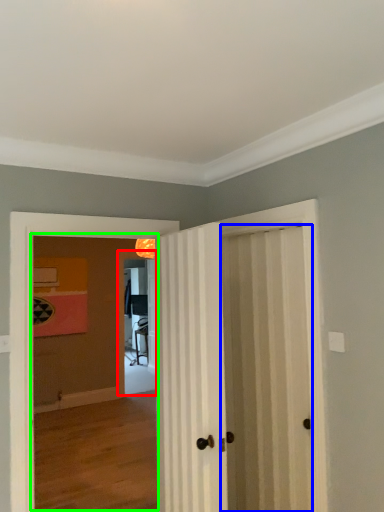
Question: Which is farther away from screen door (highlighted by a red box)? door (highlighted by a blue box) or corridor (highlighted by a green box)?

Choices:
 (A) door
 (B) corridor

Answer: (A)